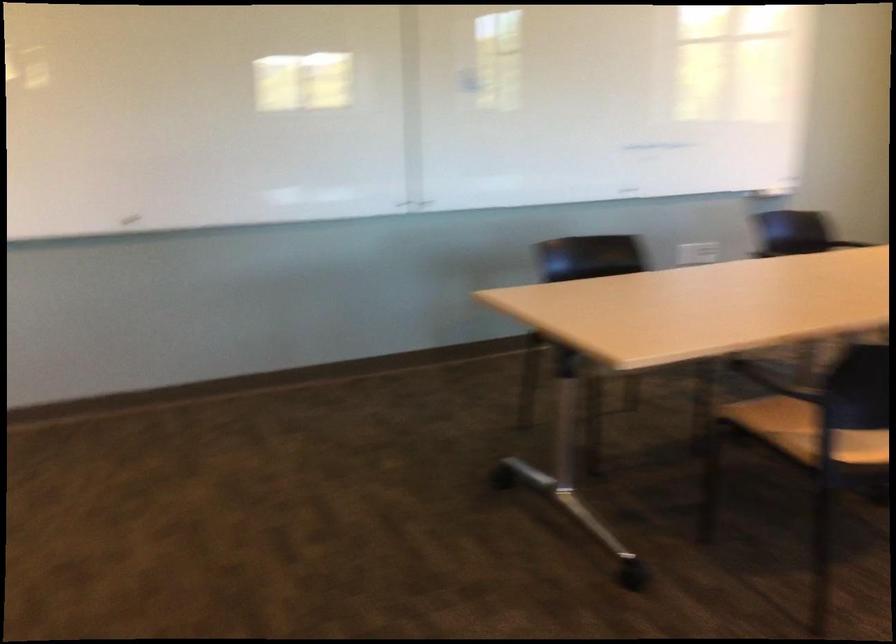
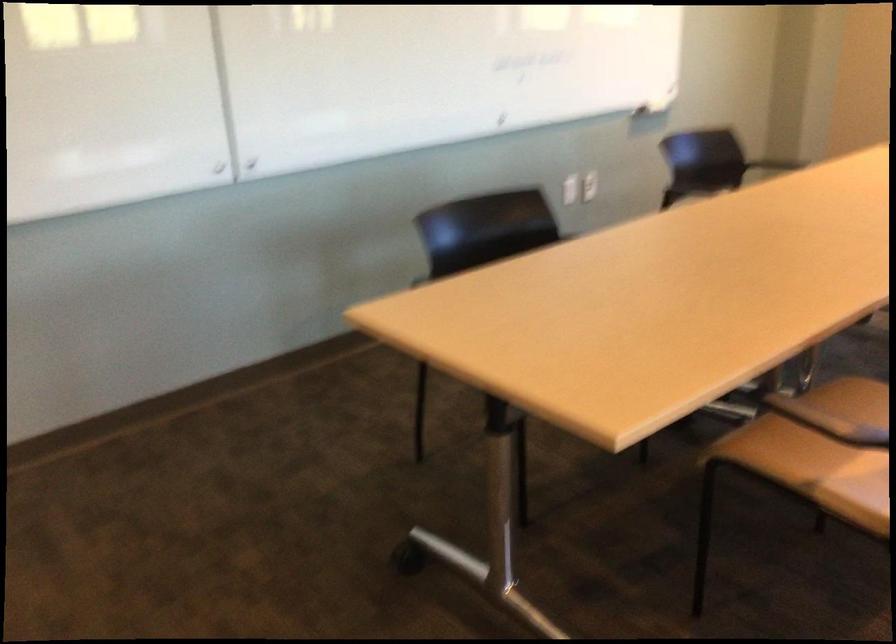
Question: The camera is either moving clockwise (left) or counter-clockwise (right) around the object. The first image is from the beginning of the video and the second image is from the end. Is the camera moving left or right when shooting the video?

Choices:
 (A) Left
 (B) Right

Answer: (A)